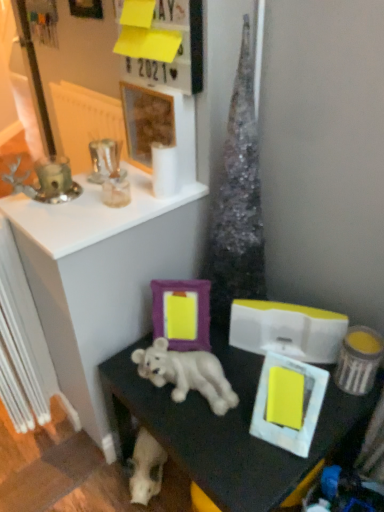
This screenshot has height=512, width=384. Describe the element at coordinates (86, 9) in the screenshot. I see `metallic silver picture frame at upper left, which appears as the 1th picture frame when viewed from the back` at that location.

In order to face wooden frame at upper center, placed as the 2th picture frame when sorted from top to bottom, should I rotate leftwards or rightwards?

Turn left approximately 4.228 degrees to face it.

This screenshot has height=512, width=384. What do you see at coordinates (177, 50) in the screenshot?
I see `yellow paper at upper center` at bounding box center [177, 50].

Image resolution: width=384 pixels, height=512 pixels. What do you see at coordinates (46, 181) in the screenshot?
I see `silver metallic candle holder at upper left` at bounding box center [46, 181].

What do you see at coordinates (186, 374) in the screenshot?
I see `white matte dog at center` at bounding box center [186, 374].

The height and width of the screenshot is (512, 384). Find the location of `white glossy table at center`. white glossy table at center is located at coordinates (227, 428).

You are a GUI agent. You are given a task and a screenshot of the screen. Output one action in this format:
    pyautogui.click(x=<x>, y=<y>)
    Task: Click on the metallic silver picture frame at upper left, which appears as the 1th picture frame when viewed from the back
    The image size is (384, 512).
    Given the screenshot: What is the action you would take?
    pyautogui.click(x=86, y=9)

Considering the sizes of objects yellow paper at upper center and metallic silver picture frame at upper left, which is counted as the 1th picture frame, starting from the left, in the image provided, who is smaller, yellow paper at upper center or metallic silver picture frame at upper left, which is counted as the 1th picture frame, starting from the left,?

metallic silver picture frame at upper left, which is counted as the 1th picture frame, starting from the left.

Which object is thinner, yellow paper at upper center or metallic silver picture frame at upper left, which appears as the 1th picture frame when viewed from the back?

Thinner between the two is metallic silver picture frame at upper left, which appears as the 1th picture frame when viewed from the back.

Can you confirm if yellow paper at upper center is shorter than metallic silver picture frame at upper left, the fourth picture frame ordered from the bottom?

Incorrect, the height of yellow paper at upper center does not fall short of that of metallic silver picture frame at upper left, the fourth picture frame ordered from the bottom.

Looking at this image, does metallic silver picture frame at upper left, the 1th picture frame when ordered from top to bottom, have a lesser height compared to white glossy table at center?

Correct, metallic silver picture frame at upper left, the 1th picture frame when ordered from top to bottom, is not as tall as white glossy table at center.

What are the coordinates of `table that appears in front of the metallic silver picture frame at upper left, which appears as the 1th picture frame when viewed from the back` in the screenshot? It's located at (227, 428).

From the image's perspective, which object appears higher, metallic silver picture frame at upper left, which is counted as the 1th picture frame, starting from the left, or white glossy table at center?

metallic silver picture frame at upper left, which is counted as the 1th picture frame, starting from the left.

From a real-world perspective, which object stands above the other?

In real-world perspective, metallic silver picture frame at upper left, which is counted as the 1th picture frame, starting from the left, is above.

Does yellow paper at upper center come behind white matte picture frame at lower right, which is counted as the fourth picture frame, starting from the back?

Yes, it is.

Would you say yellow paper at upper center is to the left or to the right of white matte picture frame at lower right, arranged as the first picture frame when viewed from the right, in the picture?

yellow paper at upper center is positioned on white matte picture frame at lower right, arranged as the first picture frame when viewed from the right,'s left side.

Would you consider yellow paper at upper center to be distant from white matte picture frame at lower right, the 4th picture frame viewed from the top?

No, there isn't a large distance between yellow paper at upper center and white matte picture frame at lower right, the 4th picture frame viewed from the top.

Does yellow paper at upper center have a lesser height compared to white matte picture frame at lower right, the 4th picture frame viewed from the top?

In fact, yellow paper at upper center may be taller than white matte picture frame at lower right, the 4th picture frame viewed from the top.

Is white plastic radiator at left smaller than wooden frame at upper center, the 2th picture frame positioned from the front?

Incorrect, white plastic radiator at left is not smaller in size than wooden frame at upper center, the 2th picture frame positioned from the front.

From a real-world perspective, which object rests below the other?

In real-world perspective, white plastic radiator at left is lower.

Does white plastic radiator at left have a lesser width compared to wooden frame at upper center, placed as the 2th picture frame when sorted from top to bottom?

Incorrect, the width of white plastic radiator at left is not less than that of wooden frame at upper center, placed as the 2th picture frame when sorted from top to bottom.

Locate an element on the screen. the 2nd picture frame to the right when counting from the white plastic radiator at left is located at coordinates click(x=146, y=122).

In terms of width, does white matte dog at center look wider or thinner when compared to white glossy table at center?

Clearly, white matte dog at center has less width compared to white glossy table at center.

Is white matte dog at center shorter than white glossy table at center?

Indeed, white matte dog at center has a lesser height compared to white glossy table at center.

Does white matte dog at center come behind white glossy table at center?

Yes, white matte dog at center is behind white glossy table at center.

Is white matte dog at center not near white glossy table at center?

Actually, white matte dog at center and white glossy table at center are a little close together.

There is a metallic silver picture frame at upper left, which is counted as the 1th picture frame, starting from the left. Where is `the 3rd picture frame below it (from the image's perspective)`? the 3rd picture frame below it (from the image's perspective) is located at coordinates (304, 401).

Does point (264, 392) come closer to viewer compared to point (81, 1)?

That is True.

Do you think white matte picture frame at lower right, acting as the 1th picture frame starting from the bottom, is within metallic silver picture frame at upper left, which is the 4th picture frame in front-to-back order, or outside of it?

white matte picture frame at lower right, acting as the 1th picture frame starting from the bottom, lies outside metallic silver picture frame at upper left, which is the 4th picture frame in front-to-back order.

Looking at this image, from the image's perspective, is wooden frame at upper center, placed as the 2th picture frame when sorted from top to bottom, positioned above or below yellow paper at upper center?

Based on their image positions, wooden frame at upper center, placed as the 2th picture frame when sorted from top to bottom, is located beneath yellow paper at upper center.

Would you say wooden frame at upper center, the second picture frame when ordered from left to right, contains yellow paper at upper center?

No.

Considering the sizes of objects wooden frame at upper center, acting as the 3th picture frame starting from the back, and yellow paper at upper center in the image provided, who is thinner, wooden frame at upper center, acting as the 3th picture frame starting from the back, or yellow paper at upper center?

wooden frame at upper center, acting as the 3th picture frame starting from the back, is thinner.

Which is in front, point (152, 116) or point (197, 50)?

The point (197, 50) is closer.

Image resolution: width=384 pixels, height=512 pixels. Find the location of `picture frame above the yellow paper at upper center (from a real-world perspective)`. picture frame above the yellow paper at upper center (from a real-world perspective) is located at coordinates (86, 9).

This screenshot has width=384, height=512. What are the coordinates of `table that is below the metallic silver picture frame at upper left, the 1th picture frame when ordered from top to bottom (from the image's perspective)` in the screenshot? It's located at (227, 428).

From the image, which object appears to be farther from white matte dog at center, metallic silver picture frame at upper left, positioned as the 4th picture frame in right-to-left order, or white matte skull at lower center?

metallic silver picture frame at upper left, positioned as the 4th picture frame in right-to-left order.

Looking at this image, when comparing their distances from yellow paper at upper center, does white matte dog at center or white plastic radiator at left seem further?

The object further to yellow paper at upper center is white plastic radiator at left.

From the image, which object appears to be farther from yellow matte box at lower right, white glossy table at center or purple matte picture frame at center, which is the second picture frame in bottom-to-top order?

The object further to yellow matte box at lower right is purple matte picture frame at center, which is the second picture frame in bottom-to-top order.

Based on their spatial positions, is metallic silver picture frame at upper left, the fourth picture frame ordered from the bottom, or yellow matte box at lower right further from white glossy table at center?

metallic silver picture frame at upper left, the fourth picture frame ordered from the bottom, is further to white glossy table at center.

When comparing their distances from yellow matte box at lower right, does white matte dog at center or metallic silver picture frame at upper left, the fourth picture frame ordered from the bottom, seem further?

metallic silver picture frame at upper left, the fourth picture frame ordered from the bottom, lies further to yellow matte box at lower right than the other object.

Looking at the image, which one is located further to metallic silver picture frame at upper left, which appears as the 1th picture frame when viewed from the back, white matte dog at center or white glossy table at center?

Based on the image, white glossy table at center appears to be further to metallic silver picture frame at upper left, which appears as the 1th picture frame when viewed from the back.

From the image, which object appears to be nearer to white plastic radiator at left, wooden frame at upper center, placed as the 2th picture frame when sorted from top to bottom, or purple matte picture frame at center, the 2th picture frame viewed from the right?

Among the two, purple matte picture frame at center, the 2th picture frame viewed from the right, is located nearer to white plastic radiator at left.

Which object lies further to the anchor point white matte picture frame at lower right, arranged as the first picture frame when viewed from the right, yellow matte box at lower right or white plastic radiator at left?

white plastic radiator at left is further to white matte picture frame at lower right, arranged as the first picture frame when viewed from the right.

Where is `animal between white plastic radiator at left and white matte dog at center in the horizontal direction`? animal between white plastic radiator at left and white matte dog at center in the horizontal direction is located at coordinates point(146,468).

This screenshot has height=512, width=384. Identify the location of radiator between wooden frame at upper center, the second picture frame when ordered from left to right, and white glossy table at center, in the vertical direction. (22, 343).

Find the location of a particular element. dog between wooden frame at upper center, acting as the 3th picture frame starting from the back, and white matte skull at lower center, in the vertical direction is located at coordinates (186, 374).

In order to click on radiator between silver metallic candle holder at upper left and white matte skull at lower center in the up-down direction in this screenshot , I will do `click(22, 343)`.